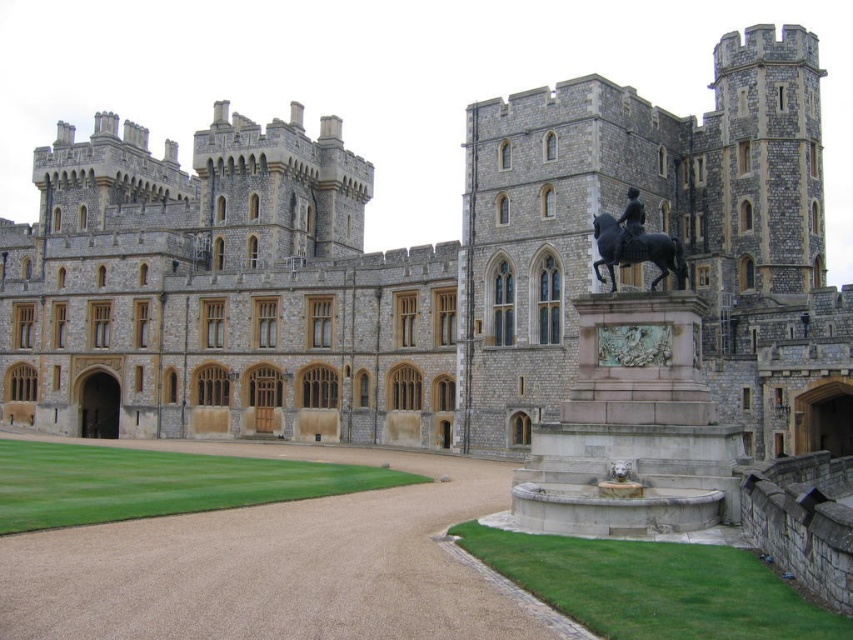
Question: Is gray stone castle at center bigger than polished bronze statue at center-right?

Choices:
 (A) yes
 (B) no

Answer: (A)

Question: Which object is closer to the camera taking this photo?

Choices:
 (A) polished bronze statue at center-right
 (B) gray stone castle at center

Answer: (A)

Question: Can you confirm if gray stone castle at center is smaller than polished bronze statue at center-right?

Choices:
 (A) no
 (B) yes

Answer: (A)

Question: Which point is closer to the camera taking this photo?

Choices:
 (A) (631, 250)
 (B) (194, 310)

Answer: (A)

Question: Is gray stone castle at center further to the viewer compared to polished bronze statue at center-right?

Choices:
 (A) yes
 (B) no

Answer: (A)